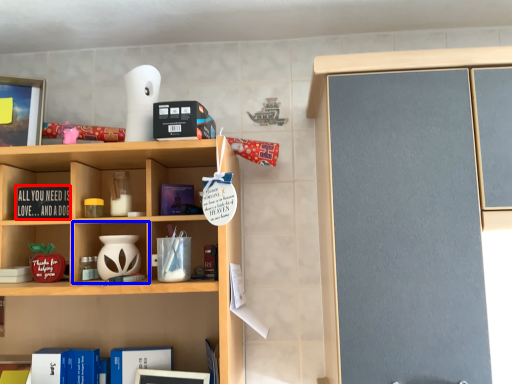
Question: Which point is closer to the camera, book (highlighted by a red box) or cabinet (highlighted by a blue box)?

Choices:
 (A) book
 (B) cabinet

Answer: (B)